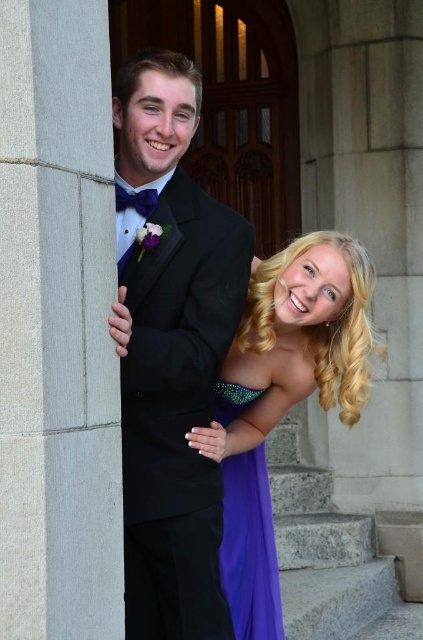
You are a photographer trying to capture a group photo of the black satin tuxedo at center and the purple satin dress at center. Since you want to ensure both are visible, which one should you place on the left side to align with their current positions?

The black satin tuxedo at center should be placed on the left side because it is already positioned on the left side of the purple satin dress at center.

You are taking a photo of the gray stone pillar at left and the purple satin dress at lower right. Which object is closer to the camera?

The gray stone pillar at left is positioned over the purple satin dress at lower right, so the gray stone pillar at left is closer to the camera.